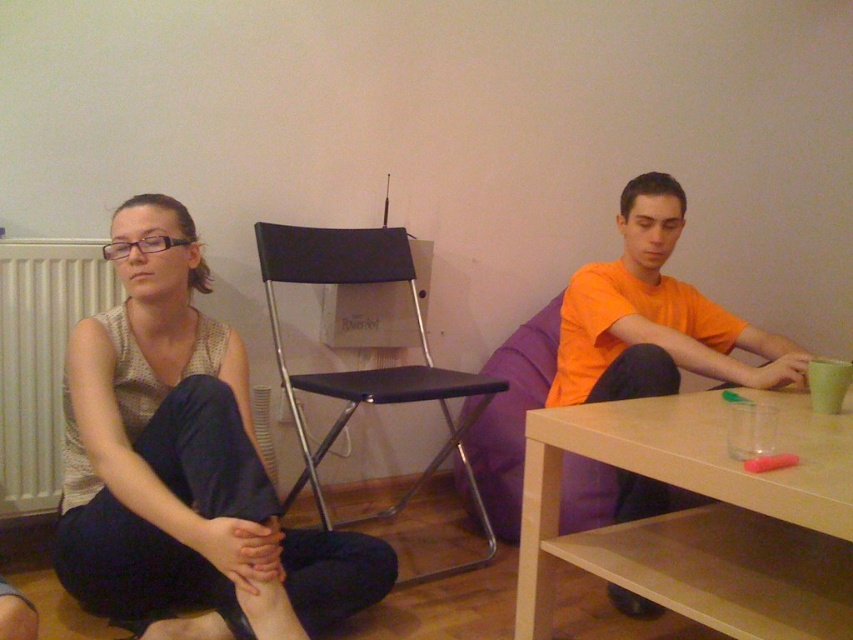
You are a guest in this room and want to sit down. There is a matte black chair at center and a white matte radiator at left. Which one is higher in elevation?

The matte black chair at center is above the white matte radiator at left, so the matte black chair at center is higher in elevation.

You are organizing a clothing donation drive and need to determine if the matte gray tank top at center can fit on the light brown wood table at lower right. Based on their sizes, will it physically fit?

The matte gray tank top at center has a larger size compared to light brown wood table at lower right, so it will not physically fit on the table.

You are a photographer trying to capture a candid shot of the two people in the scene. You notice the matte gray tank top at center and the light brown wood table at lower right. Which object is taller, and how might this affect your composition?

The matte gray tank top at center is taller than the light brown wood table at lower right. This means you should position your camera angle to account for the tank top potentially blocking the table if not framed carefully.